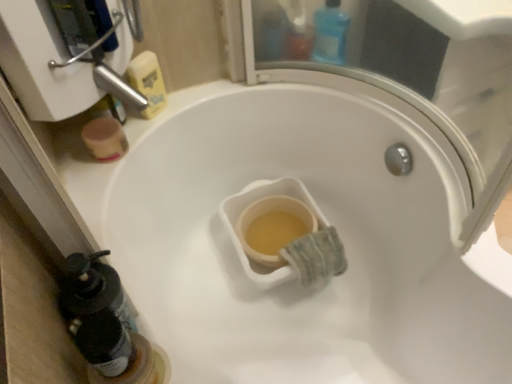
Question: Does translucent plastic bottle at lower left, which is the first bottle from bottom to top, have a lesser height compared to blue plastic bottle at upper center, the first bottle from the back?

Choices:
 (A) yes
 (B) no

Answer: (A)

Question: Is translucent plastic bottle at lower left, which is the first bottle from bottom to top, thinner than blue plastic bottle at upper center, which ranks as the 1th bottle in right-to-left order?

Choices:
 (A) yes
 (B) no

Answer: (A)

Question: Considering the relative positions of translucent plastic bottle at lower left, which ranks as the first bottle in left-to-right order, and blue plastic bottle at upper center, positioned as the second bottle in left-to-right order, in the image provided, is translucent plastic bottle at lower left, which ranks as the first bottle in left-to-right order, to the right of blue plastic bottle at upper center, positioned as the second bottle in left-to-right order, from the viewer's perspective?

Choices:
 (A) no
 (B) yes

Answer: (A)

Question: Does translucent plastic bottle at lower left, acting as the first bottle starting from the front, have a greater height compared to blue plastic bottle at upper center, the 1th bottle when ordered from top to bottom?

Choices:
 (A) yes
 (B) no

Answer: (B)

Question: From a real-world perspective, is translucent plastic bottle at lower left, acting as the first bottle starting from the front, beneath blue plastic bottle at upper center, the first bottle from the back?

Choices:
 (A) no
 (B) yes

Answer: (A)

Question: Is translucent plastic bottle at lower left, acting as the first bottle starting from the front, positioned before blue plastic bottle at upper center, which is the second bottle in bottom-to-top order?

Choices:
 (A) yes
 (B) no

Answer: (A)

Question: Does blue plastic bottle at upper center, which ranks as the 1th bottle in right-to-left order, turn towards yellow matte sponge at upper left?

Choices:
 (A) yes
 (B) no

Answer: (B)

Question: From a real-world perspective, is blue plastic bottle at upper center, which is the second bottle in bottom-to-top order, beneath yellow matte sponge at upper left?

Choices:
 (A) no
 (B) yes

Answer: (A)

Question: Is blue plastic bottle at upper center, which ranks as the 1th bottle in right-to-left order, smaller than yellow matte sponge at upper left?

Choices:
 (A) yes
 (B) no

Answer: (B)

Question: Considering the relative positions of blue plastic bottle at upper center, the first bottle from the back, and yellow matte sponge at upper left in the image provided, is blue plastic bottle at upper center, the first bottle from the back, to the right of yellow matte sponge at upper left from the viewer's perspective?

Choices:
 (A) yes
 (B) no

Answer: (A)

Question: Is blue plastic bottle at upper center, positioned as the second bottle in left-to-right order, not inside yellow matte sponge at upper left?

Choices:
 (A) no
 (B) yes

Answer: (B)

Question: Is blue plastic bottle at upper center, which is the second bottle in bottom-to-top order, positioned with its back to yellow matte sponge at upper left?

Choices:
 (A) no
 (B) yes

Answer: (B)

Question: Does blue plastic bottle at upper center, the 1th bottle when ordered from top to bottom, lie in front of translucent plastic bottle at lower left, which ranks as the first bottle in left-to-right order?

Choices:
 (A) yes
 (B) no

Answer: (B)